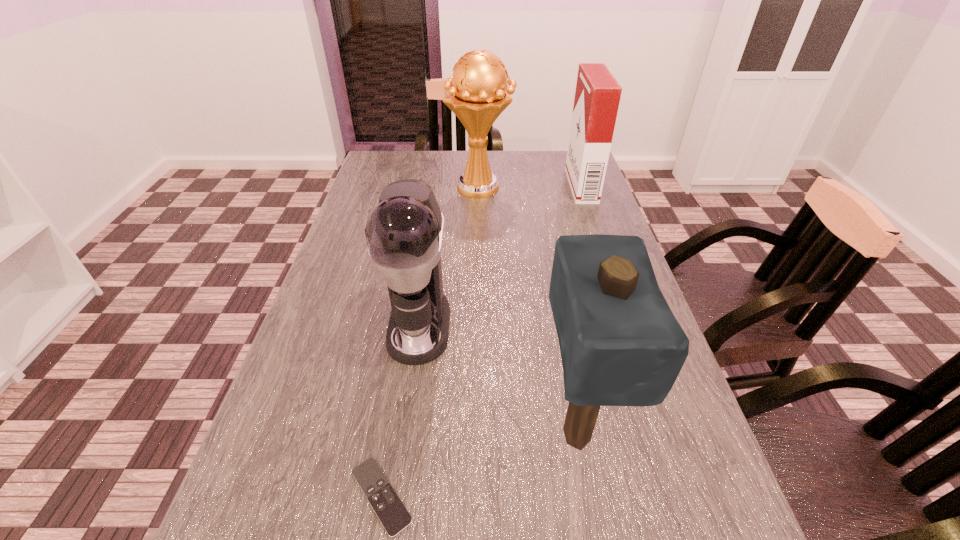
Find the location of a particular element. This screenshot has height=540, width=960. trophy_cup is located at coordinates (479, 95).

The image size is (960, 540). I want to click on the fourth object from left to right, so click(620, 344).

Identify the location of cigarette_case. (597, 96).

Locate an element on the screen. the third nearest object is located at coordinates (404, 232).

Where is `the shortest object`? This screenshot has width=960, height=540. the shortest object is located at coordinates (393, 515).

You are a GUI agent. You are given a task and a screenshot of the screen. Output one action in this format:
    pyautogui.click(x=<x>, y=<y>)
    Task: Click on the free space located at the front of the trophy_cup where the globe is prominent
    The width and height of the screenshot is (960, 540).
    Given the screenshot: What is the action you would take?
    pyautogui.click(x=564, y=187)

Locate an element on the screen. free space located 0.260m on the back of the mallet is located at coordinates (551, 293).

Locate an element on the screen. The height and width of the screenshot is (540, 960). free spot located on the front-facing side of the rightmost object is located at coordinates (509, 186).

Find the location of a particular element. The height and width of the screenshot is (540, 960). vacant area situated 0.320m on the front-facing side of the rightmost object is located at coordinates (471, 186).

Find the location of a particular element. Image resolution: width=960 pixels, height=540 pixels. free space located on the front-facing side of the rightmost object is located at coordinates (530, 186).